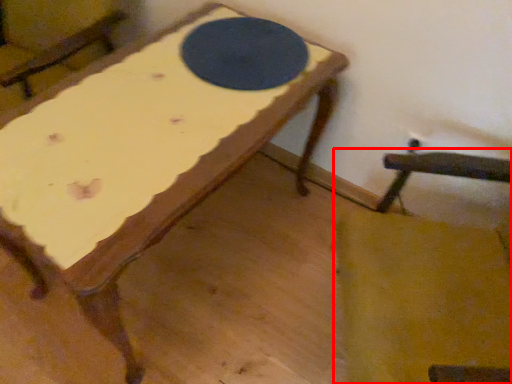
Question: From the image's perspective, what is the correct spatial relationship of rocking chair (annotated by the red box) in relation to table tennis table?

Choices:
 (A) below
 (B) above

Answer: (A)